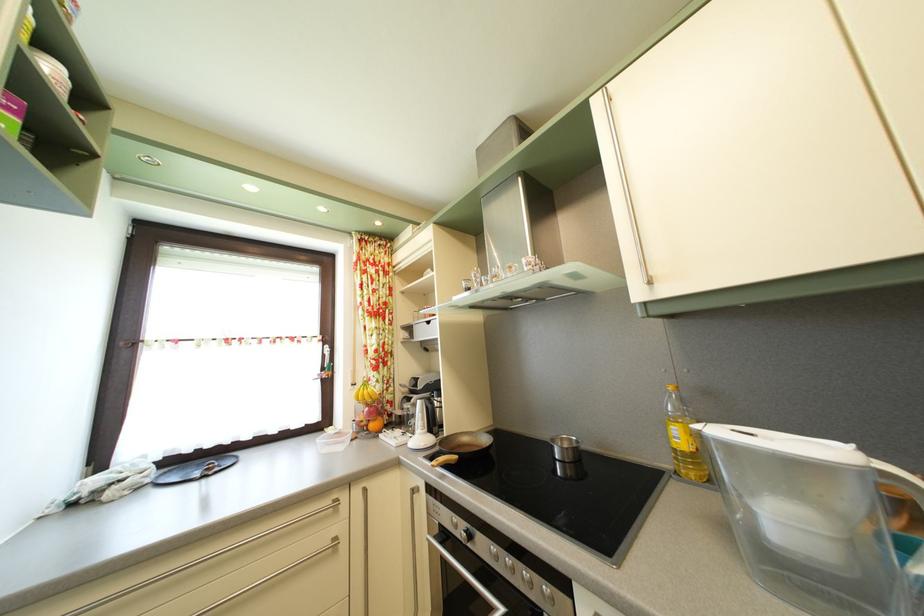
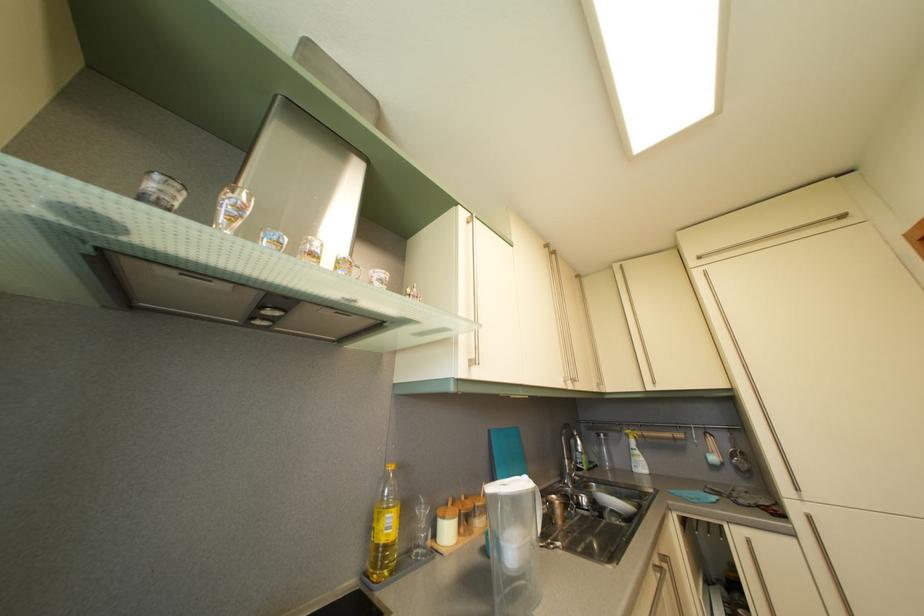
Find the pixel in the second image that matches point 793,528 in the first image.

(521, 554)